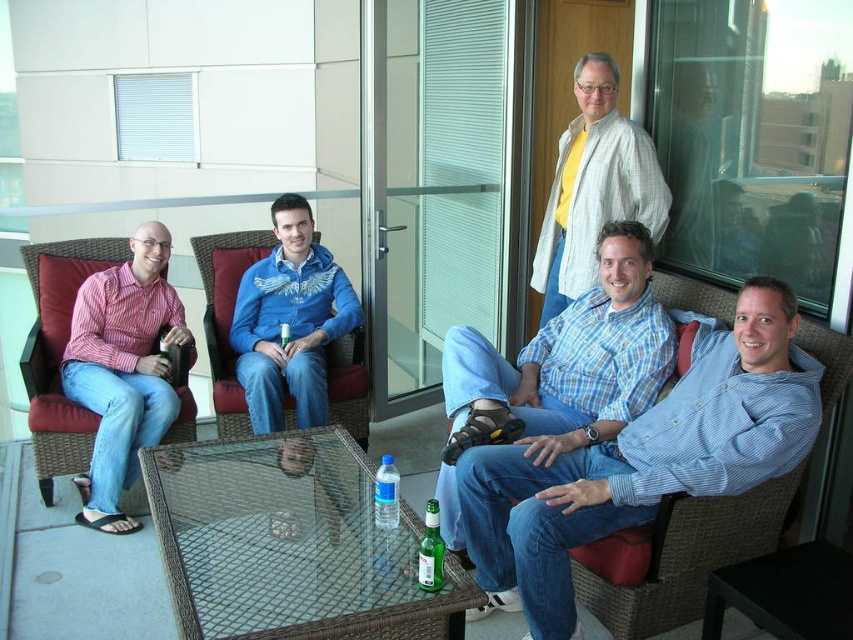
Between blue striped shirt at center and blue plaid shirt at center, which one has less height?

blue plaid shirt at center

Which is in front, point (788, 336) or point (543, 420)?

Point (788, 336) is in front.

Where is `blue striped shirt at center`? The width and height of the screenshot is (853, 640). blue striped shirt at center is located at coordinates (643, 458).

At what (x,y) coordinates should I click in order to perform the action: click on blue striped shirt at center. Please return your answer as a coordinate pair (x, y). Looking at the image, I should click on (643, 458).

Between blue fleece jacket at center and clear plastic water bottle at center, which one is positioned lower?

Positioned lower is clear plastic water bottle at center.

Who is higher up, blue fleece jacket at center or clear plastic water bottle at center?

blue fleece jacket at center

The width and height of the screenshot is (853, 640). Find the location of `blue fleece jacket at center`. blue fleece jacket at center is located at coordinates (289, 321).

Who is more forward, (134,369) or (576,296)?

Point (134,369)

At what (x,y) coordinates should I click in order to perform the action: click on matte pink shirt at left. Please return your answer as a coordinate pair (x, y). The image size is (853, 640). Looking at the image, I should click on (123, 371).

Does point (148, 227) lie in front of point (582, 276)?

That is False.

I want to click on matte pink shirt at left, so pos(123,371).